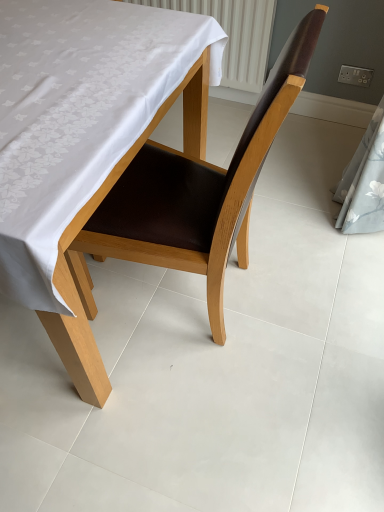
What are the coordinates of `free location to the right of brown leather chair at center` in the screenshot? It's located at [x=309, y=287].